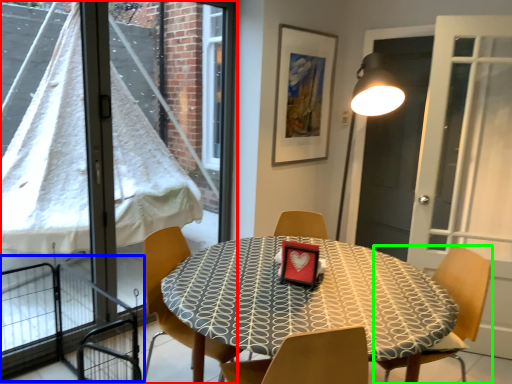
Question: Considering the real-world distances, which object is farthest from window (highlighted by a red box)? balcony (highlighted by a blue box) or chair (highlighted by a green box)?

Choices:
 (A) balcony
 (B) chair

Answer: (B)